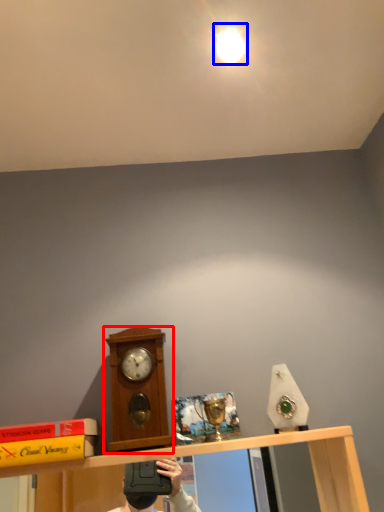
Question: Which object appears farthest to the camera in this image, clock (highlighted by a red box) or light (highlighted by a blue box)?

Choices:
 (A) clock
 (B) light

Answer: (B)